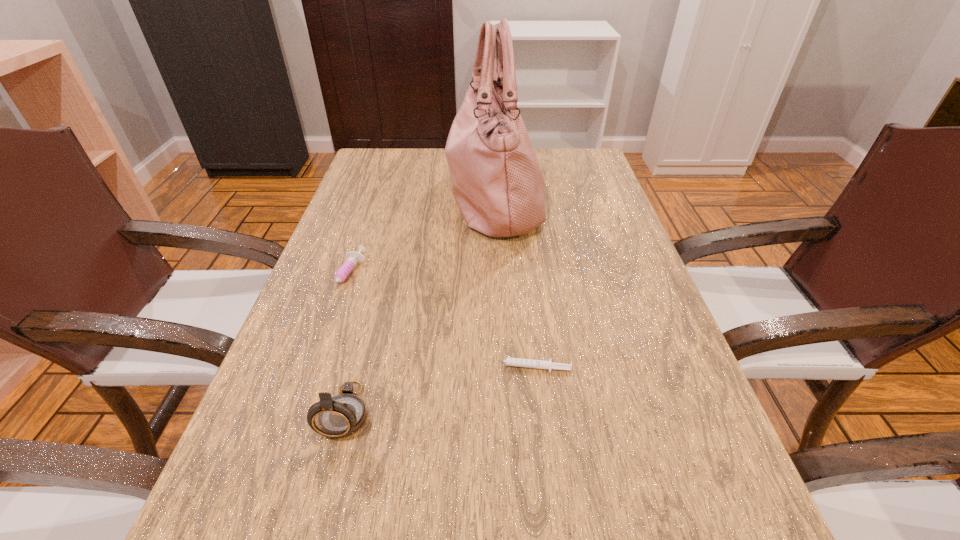
Image resolution: width=960 pixels, height=540 pixels. What are the coordinates of `vacant point at the far right corner` in the screenshot? It's located at (548, 156).

I want to click on free area in between the compass and the leftmost object, so click(x=347, y=345).

Where is `free space between the second tallest object and the shortest object`? free space between the second tallest object and the shortest object is located at coordinates (436, 389).

Locate an element on the screen. The height and width of the screenshot is (540, 960). vacant area that lies between the farthest object and the nearest object is located at coordinates (420, 303).

Where is `free space between the third object from right to left and the nearer syringe`? This screenshot has height=540, width=960. free space between the third object from right to left and the nearer syringe is located at coordinates (436, 389).

In order to click on free spot between the third shortest object and the third nearest object in this screenshot , I will do `click(347, 345)`.

The image size is (960, 540). Find the location of `free space between the farther syringe and the tallest object`. free space between the farther syringe and the tallest object is located at coordinates (420, 237).

This screenshot has height=540, width=960. Find the location of `free area in between the handbag and the nearer syringe`. free area in between the handbag and the nearer syringe is located at coordinates (511, 282).

What are the coordinates of `empty space between the taller syringe and the third shortest object` in the screenshot? It's located at (347, 345).

This screenshot has height=540, width=960. Identify the location of vacant area between the shorter syringe and the compass. (436, 389).